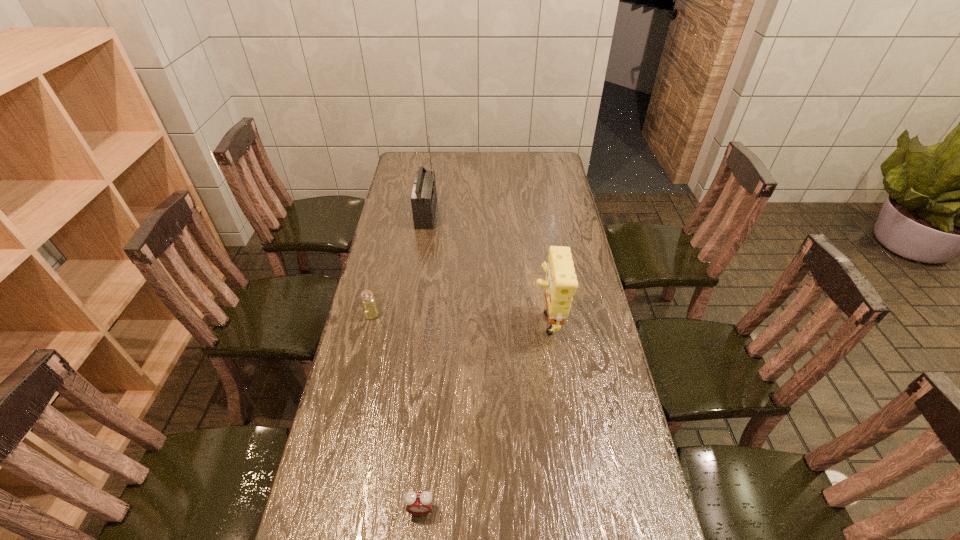
I want to click on the farthest object, so click(x=424, y=197).

At what (x,y) coordinates should I click in order to perform the action: click on the third object from right to left. Please return your answer as a coordinate pair (x, y). This screenshot has height=540, width=960. Looking at the image, I should click on (424, 197).

Where is `the rightmost object`? The height and width of the screenshot is (540, 960). the rightmost object is located at coordinates (560, 283).

Locate an element on the screen. the third shortest object is located at coordinates (x=560, y=283).

Where is `the leftmost object`? the leftmost object is located at coordinates (370, 309).

I want to click on the third object from left to right, so click(x=418, y=503).

Locate an element on the screen. the nearest object is located at coordinates (418, 503).

Locate an element on the screen. Image resolution: width=960 pixels, height=540 pixels. vacant space located on the front panel of the radio receiver is located at coordinates (529, 214).

Image resolution: width=960 pixels, height=540 pixels. I want to click on vacant space situated on the face of the rightmost object, so click(513, 318).

The image size is (960, 540). Find the location of `free point located 0.180m on the face of the rightmost object`. free point located 0.180m on the face of the rightmost object is located at coordinates point(477,318).